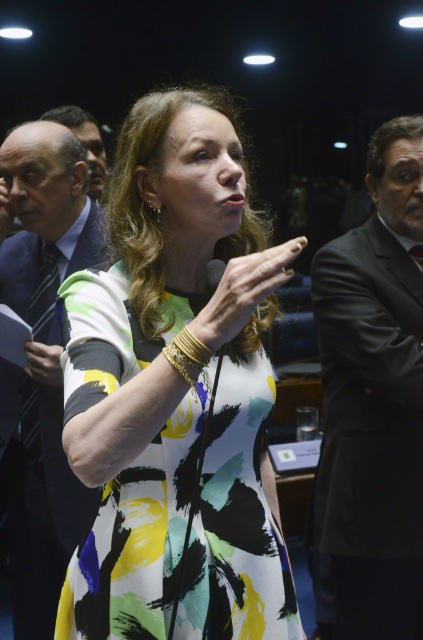
Question: Does striped fabric tie at left appear on the right side of matte gold bracelet at upper center?

Choices:
 (A) no
 (B) yes

Answer: (A)

Question: Which is nearer to the printed fabric dress at center?

Choices:
 (A) striped fabric tie at left
 (B) gold woven bracelet at center
 (C) matte gold bracelet at upper center
 (D) dark blue suit at left

Answer: (B)

Question: Which of the following is the farthest from the observer?

Choices:
 (A) (206, 310)
 (B) (216, 260)
 (C) (356, 275)
 (D) (60, 380)

Answer: (D)

Question: Does matte gold bracelet at upper center appear under gold woven bracelet at center?

Choices:
 (A) no
 (B) yes

Answer: (B)

Question: Which object appears closest to the camera in this image?

Choices:
 (A) dark gray suit at right
 (B) dark blue suit at left
 (C) striped fabric tie at left
 (D) gold woven bracelet at center

Answer: (D)

Question: Is dark gray suit at right to the right of dark blue suit at left from the viewer's perspective?

Choices:
 (A) no
 (B) yes

Answer: (B)